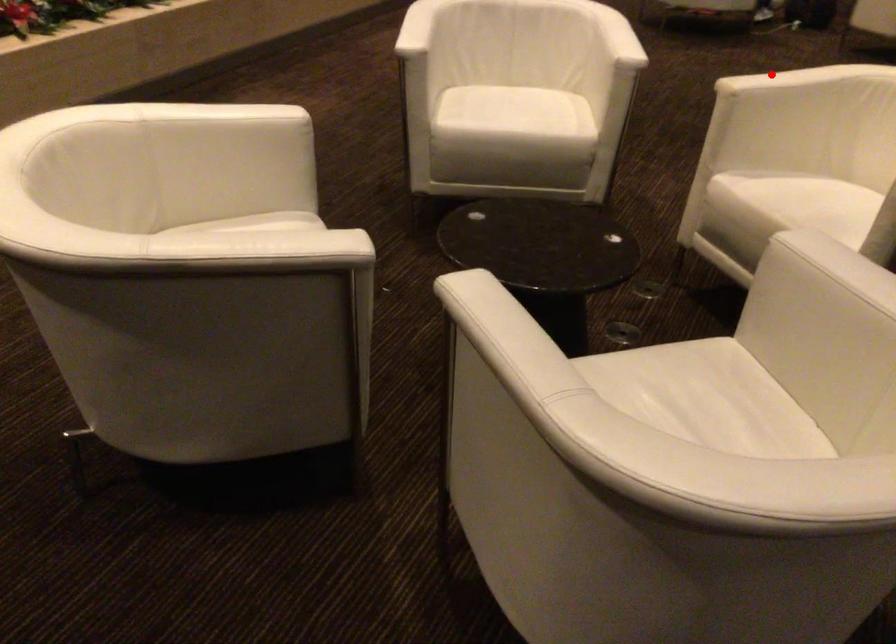
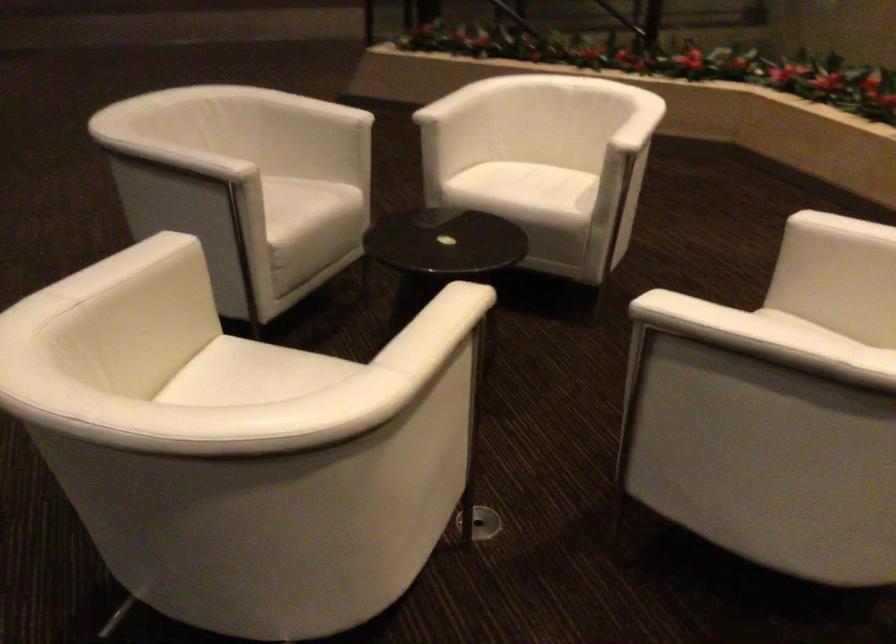
Question: A red point is marked in image1. In image2, is the corresponding 3D point closer to the camera or farther? Reply with the corresponding letter.

Choices:
 (A) The corresponding 3D point is closer.
 (B) The corresponding 3D point is farther.

Answer: (A)